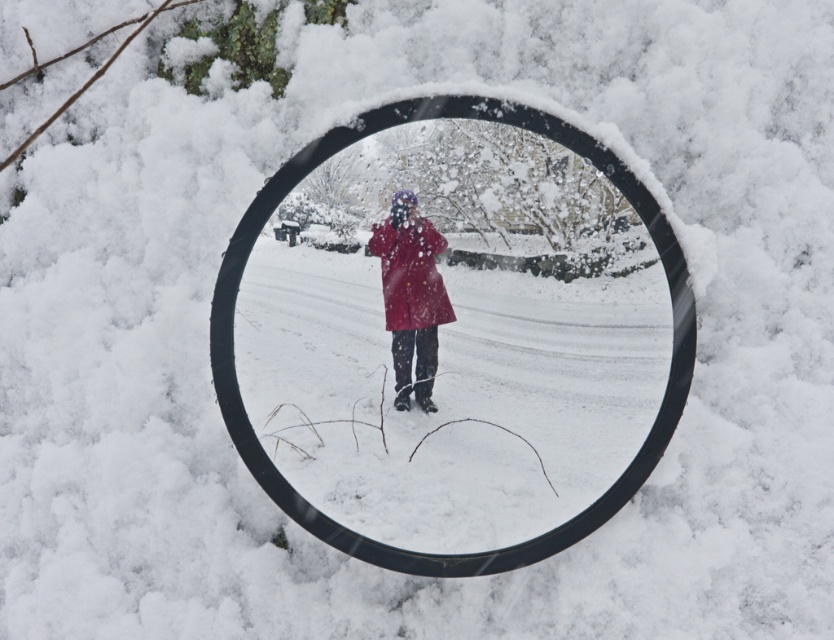
Is black plastic magnifying glass at center behind matte red coat at center?

Yes, black plastic magnifying glass at center is behind matte red coat at center.

Does point (551, 122) come in front of point (430, 323)?

Yes.

Who is more forward, [244,416] or [440,300]?

Positioned in front is point [440,300].

I want to click on black plastic magnifying glass at center, so click(x=234, y=340).